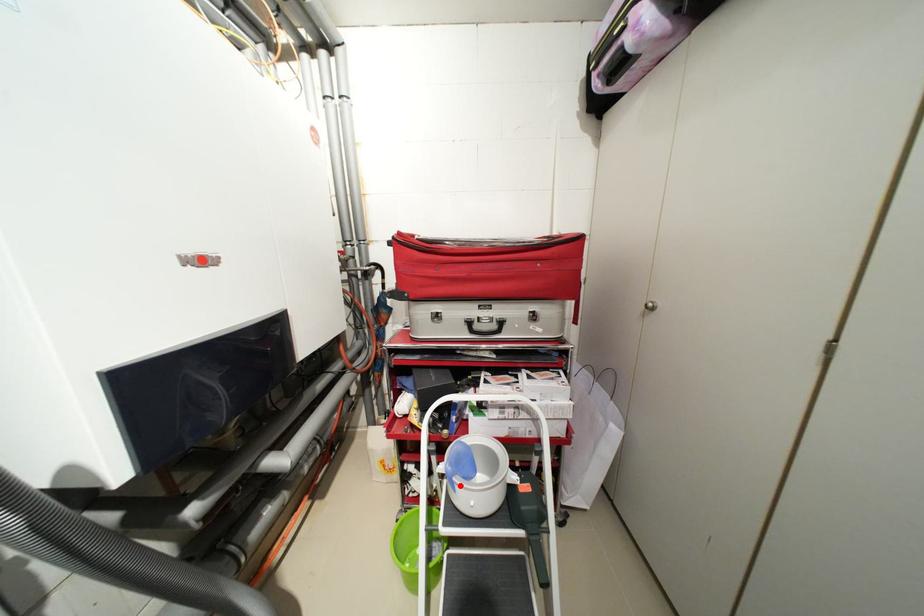
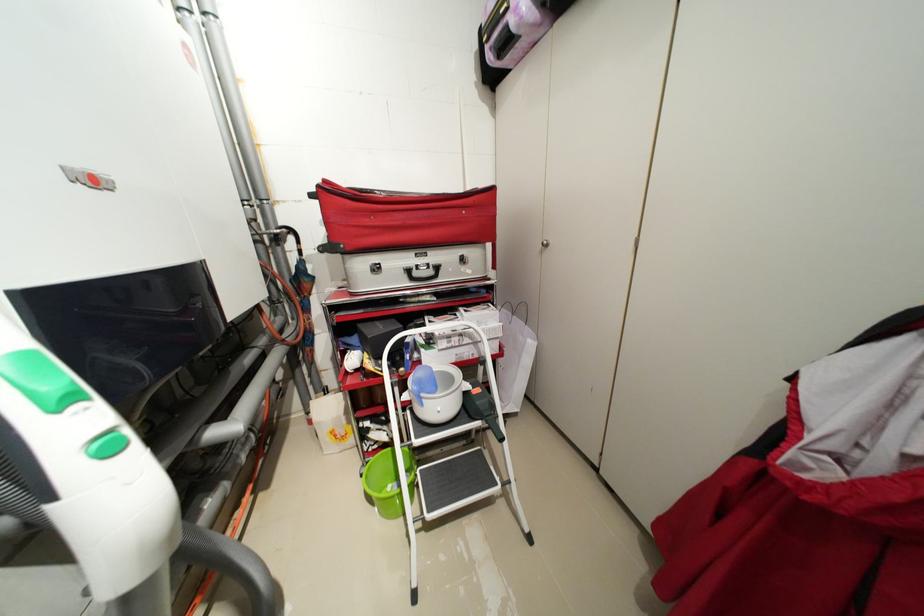
Locate, in the second image, the point that corresponds to the highlighted location in the first image.

(428, 400)